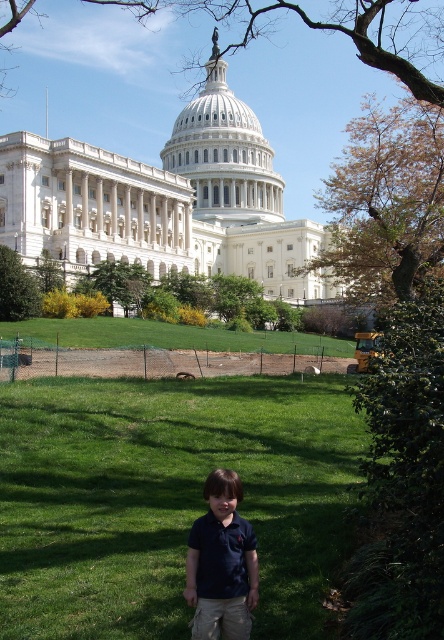
Question: Among these objects, which one is farthest from the camera?

Choices:
 (A) brown leafy tree at upper center
 (B) dark blue polo shirt at lower center
 (C) brown textured tree at upper right

Answer: (C)

Question: Which of the following is the closest to the observer?

Choices:
 (A) (245, 193)
 (B) (30, 312)
 (C) (96, 285)
 (D) (432, 164)

Answer: (D)

Question: Is brown leafy tree at upper center bigger than white marble dome at upper center?

Choices:
 (A) yes
 (B) no

Answer: (A)

Question: Is dark blue polo shirt at lower center closer to the viewer compared to green leafy tree at center?

Choices:
 (A) yes
 (B) no

Answer: (A)

Question: Which object is farther from the camera taking this photo?

Choices:
 (A) brown textured tree at upper right
 (B) dark blue polo shirt at lower center

Answer: (A)

Question: Considering the relative positions of white marble dome at upper center and dark blue polo shirt at lower center in the image provided, where is white marble dome at upper center located with respect to dark blue polo shirt at lower center?

Choices:
 (A) above
 (B) below

Answer: (A)